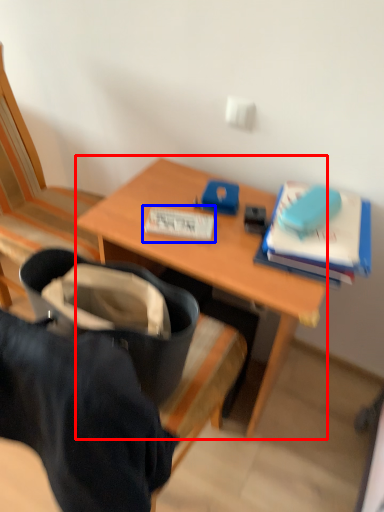
Question: Which object appears closest to the camera in this image, desk (highlighted by a red box) or paperback book (highlighted by a blue box)?

Choices:
 (A) desk
 (B) paperback book

Answer: (A)